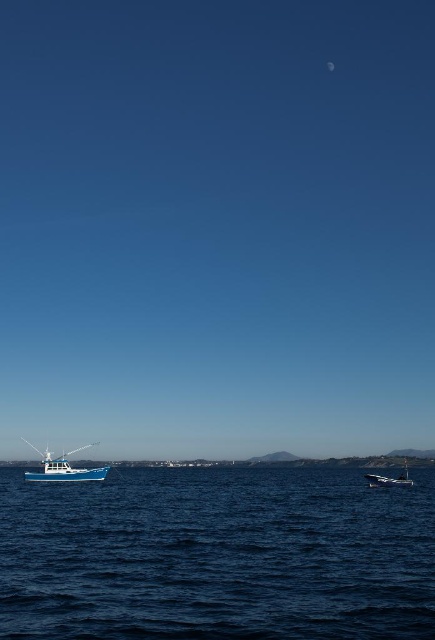
Is point (89, 481) closer to camera compared to point (370, 481)?

No, it is behind (370, 481).

Is blue matte fishing boat at lower left below shiny blue boat at lower right?

Indeed, blue matte fishing boat at lower left is positioned under shiny blue boat at lower right.

Between point (72, 472) and point (395, 483), which one is positioned in front?

Point (72, 472) is more forward.

This screenshot has height=640, width=435. Find the location of `blue matte fishing boat at lower left`. blue matte fishing boat at lower left is located at coordinates tap(63, 468).

Can you confirm if blue water at lower left is positioned below blue matte fishing boat at lower left?

No, blue water at lower left is not below blue matte fishing boat at lower left.

Does blue water at lower left have a greater height compared to blue matte fishing boat at lower left?

In fact, blue water at lower left may be shorter than blue matte fishing boat at lower left.

Measure the distance between point (358, 486) and camera.

Point (358, 486) is 55.94 meters from camera.

The height and width of the screenshot is (640, 435). Find the location of `blue water at lower left`. blue water at lower left is located at coordinates coord(217,556).

Can you confirm if blue water at lower left is taller than shiny blue boat at lower right?

No, blue water at lower left is not taller than shiny blue boat at lower right.

Is blue water at lower left further to the viewer compared to shiny blue boat at lower right?

No, it is not.

The image size is (435, 640). What do you see at coordinates (217, 556) in the screenshot? I see `blue water at lower left` at bounding box center [217, 556].

At what (x,y) coordinates should I click in order to perform the action: click on blue water at lower left. Please return your answer as a coordinate pair (x, y). The image size is (435, 640). Looking at the image, I should click on (217, 556).